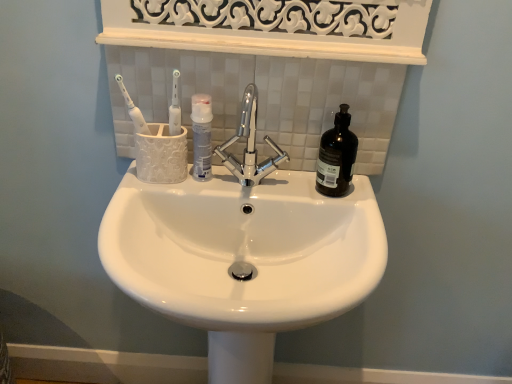
Locate an element on the screen. The image size is (512, 384). free area in between black glass bottle at right, arranged as the second mouthwash when viewed from the left, and chrome metallic faucet at center is located at coordinates (304, 186).